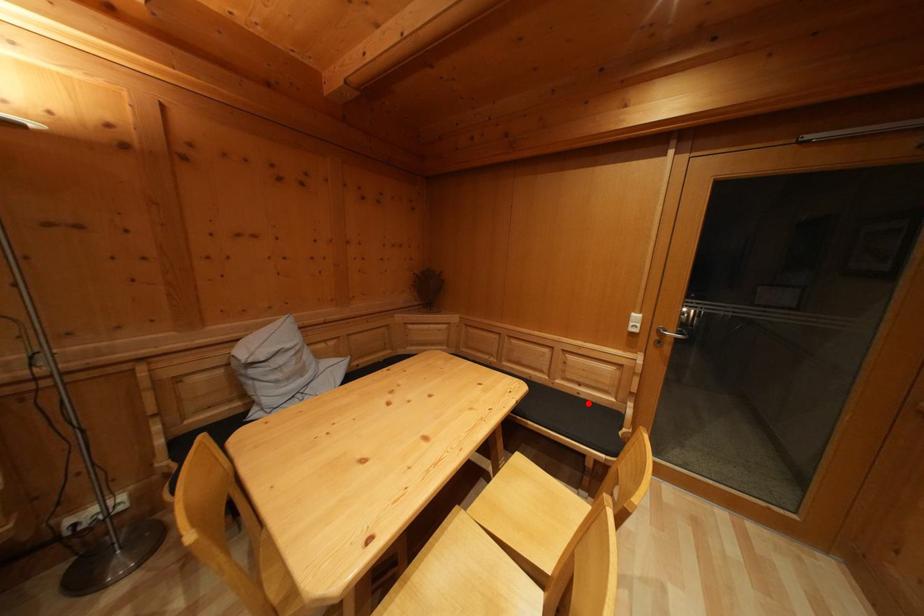
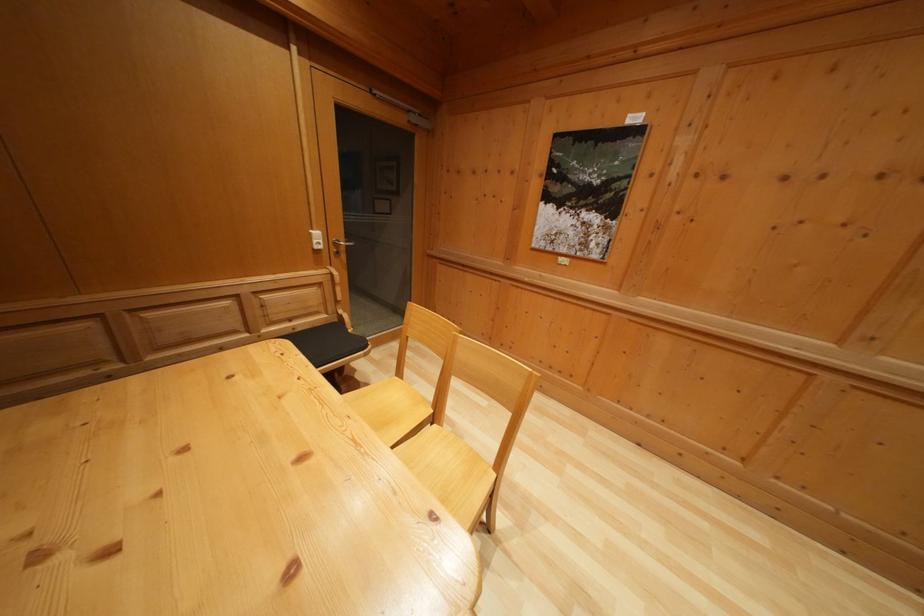
Find the pixel in the second image that matches the highlighted location in the first image.

(305, 336)